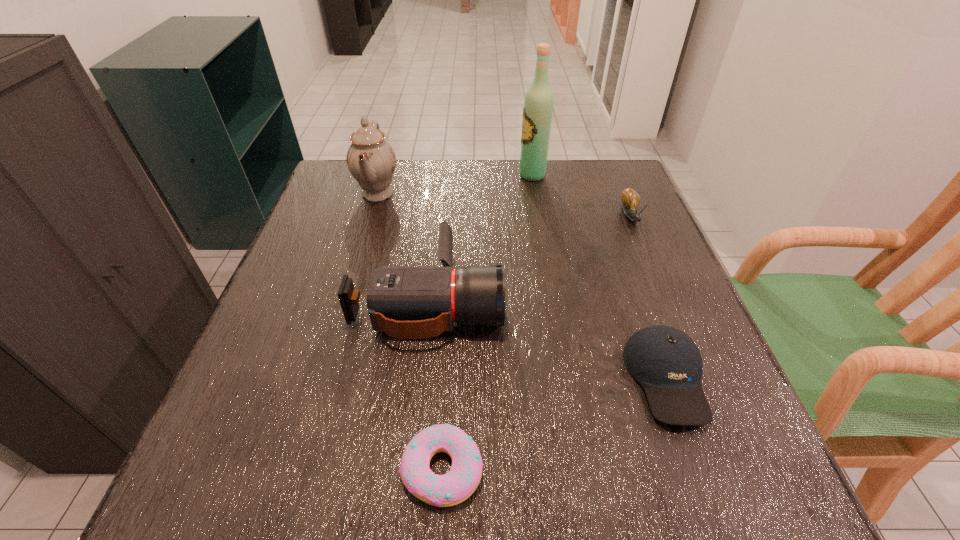
Identify which object is the second nearest to the escargot. Please provide its 2D coordinates. Your answer should be formatted as a tuple, i.e. [(x, y)], where the tuple contains the x and y coordinates of a point satisfying the conditions above.

[(667, 363)]

Point out which object is positioned as the second nearest to the baseball cap. Please provide its 2D coordinates. Your answer should be formatted as a tuple, i.e. [(x, y)], where the tuple contains the x and y coordinates of a point satisfying the conditions above.

[(454, 487)]

The height and width of the screenshot is (540, 960). Find the location of `vacant space that satisfies the following two spatial constraints: 1. on the spout of the chinaware; 2. on the back side of the doughnut`. vacant space that satisfies the following two spatial constraints: 1. on the spout of the chinaware; 2. on the back side of the doughnut is located at coordinates coord(296,469).